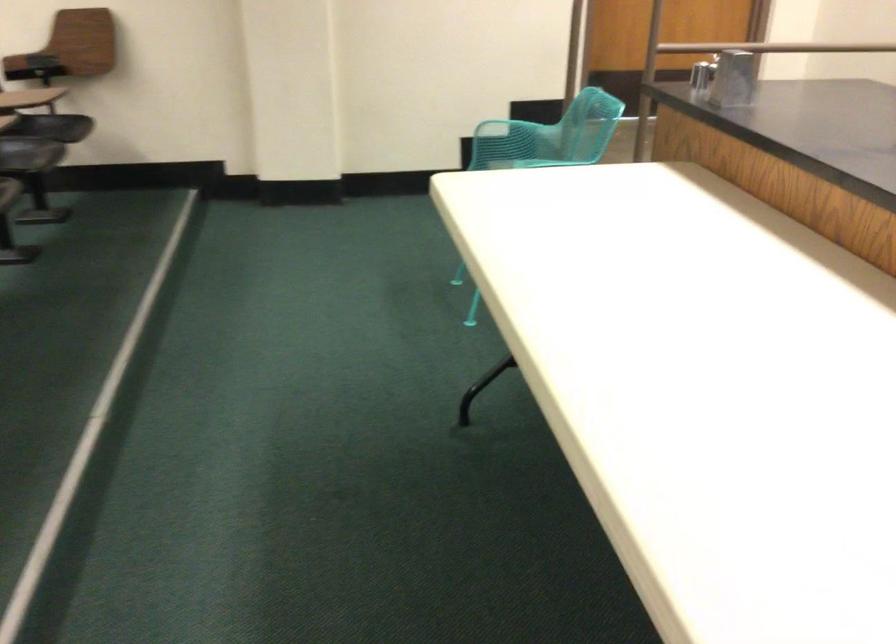
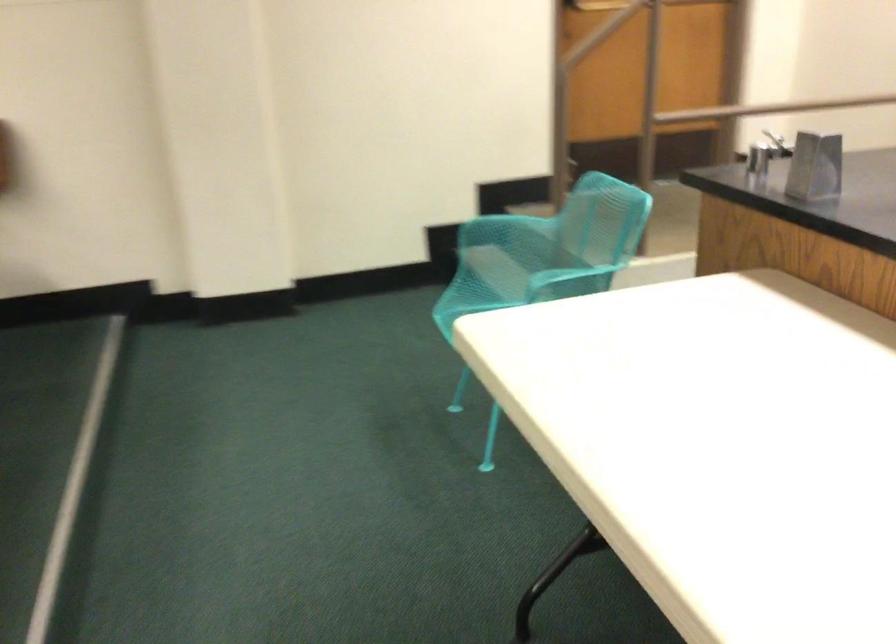
Question: What movement of the cameraman would produce the second image?

Choices:
 (A) Left
 (B) Right
 (C) Forward
 (D) Backward

Answer: (C)